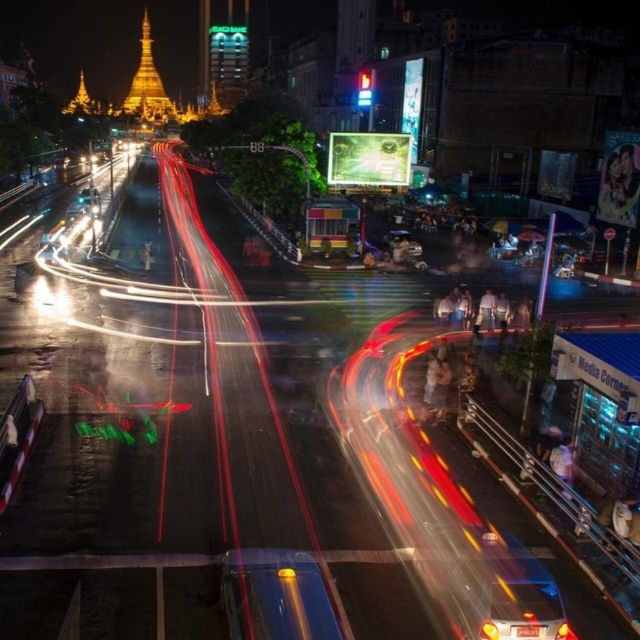
Question: Can you confirm if shiny blue car at center is positioned below yellow glass light at center?

Choices:
 (A) no
 (B) yes

Answer: (B)

Question: Is shiny blue car at center bigger than yellow glass light at center?

Choices:
 (A) no
 (B) yes

Answer: (B)

Question: Which object is farther from the camera taking this photo?

Choices:
 (A) yellow glass light at center
 (B) metallic blue car at lower right

Answer: (A)

Question: Is metallic blue car at lower right further to camera compared to shiny blue car at center?

Choices:
 (A) no
 (B) yes

Answer: (B)

Question: Which of the following is the closest to the observer?

Choices:
 (A) (285, 580)
 (B) (284, 621)

Answer: (B)

Question: Which point appears closest to the camera in this image?

Choices:
 (A) (278, 576)
 (B) (532, 636)

Answer: (B)